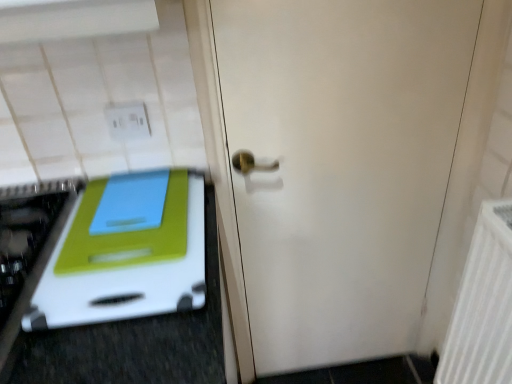
Question: Is white matte door at center turned away from white textured radiator at right?

Choices:
 (A) no
 (B) yes

Answer: (A)

Question: Does white matte door at center have a greater height compared to white textured radiator at right?

Choices:
 (A) no
 (B) yes

Answer: (B)

Question: Can you confirm if white matte door at center is positioned to the right of white textured radiator at right?

Choices:
 (A) yes
 (B) no

Answer: (B)

Question: Would you say white matte door at center is outside white textured radiator at right?

Choices:
 (A) no
 (B) yes

Answer: (B)

Question: Is white matte door at center oriented towards white textured radiator at right?

Choices:
 (A) no
 (B) yes

Answer: (B)

Question: From a real-world perspective, is white plastic cutting board at left positioned above or below white textured radiator at right?

Choices:
 (A) above
 (B) below

Answer: (A)

Question: From the image's perspective, relative to white textured radiator at right, is white plastic cutting board at left above or below?

Choices:
 (A) above
 (B) below

Answer: (A)

Question: From their relative heights in the image, would you say white plastic cutting board at left is taller or shorter than white textured radiator at right?

Choices:
 (A) short
 (B) tall

Answer: (A)

Question: Considering their positions, is white plastic cutting board at left located in front of or behind white textured radiator at right?

Choices:
 (A) behind
 (B) front

Answer: (B)

Question: Is white textured radiator at right taller or shorter than white matte door at center?

Choices:
 (A) short
 (B) tall

Answer: (A)

Question: Based on their positions, is white textured radiator at right located to the left or right of white matte door at center?

Choices:
 (A) right
 (B) left

Answer: (A)

Question: Is white textured radiator at right bigger or smaller than white matte door at center?

Choices:
 (A) big
 (B) small

Answer: (B)

Question: Is white textured radiator at right inside or outside of white matte door at center?

Choices:
 (A) inside
 (B) outside

Answer: (B)

Question: Looking at the image, does white matte door at center seem bigger or smaller compared to white plastic cutting board at left?

Choices:
 (A) big
 (B) small

Answer: (A)

Question: From the image's perspective, relative to white plastic cutting board at left, is white matte door at center above or below?

Choices:
 (A) below
 (B) above

Answer: (A)